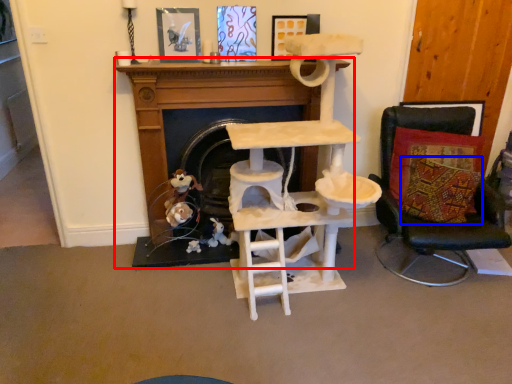
Question: Which object is closer to the camera taking this photo, fireplace (highlighted by a red box) or pillow (highlighted by a blue box)?

Choices:
 (A) fireplace
 (B) pillow

Answer: (B)